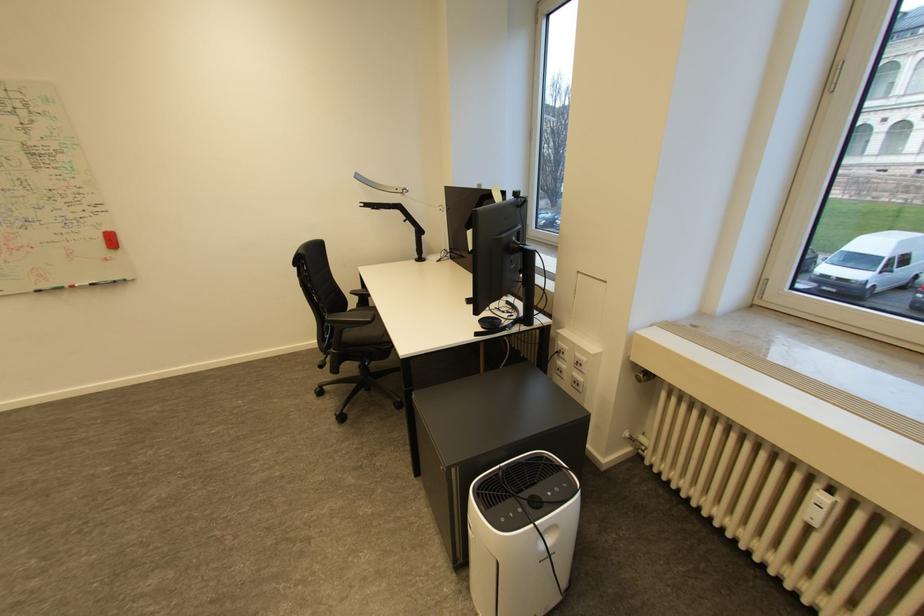
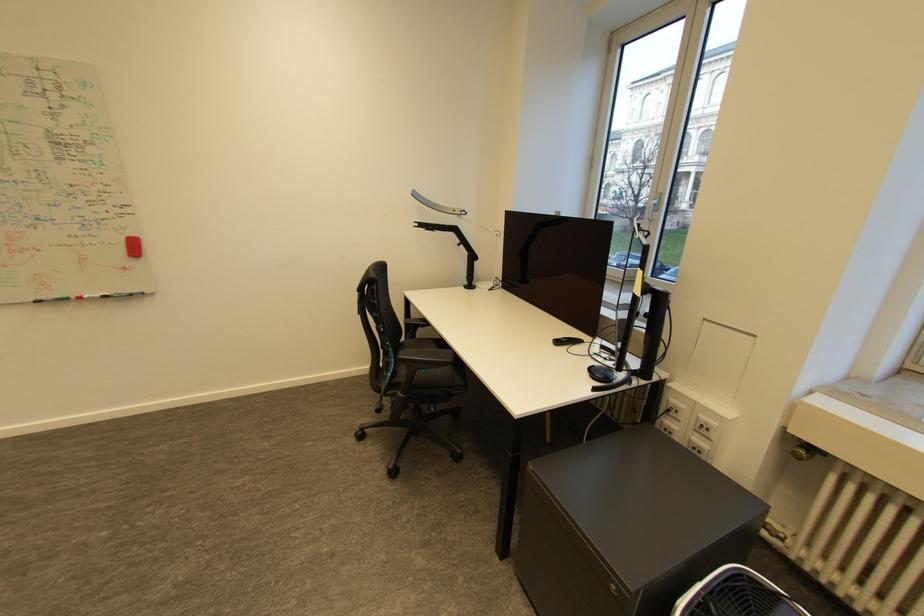
The images are taken continuously from a first-person perspective. In which direction are you moving?

The cameraman moved toward left, forward.